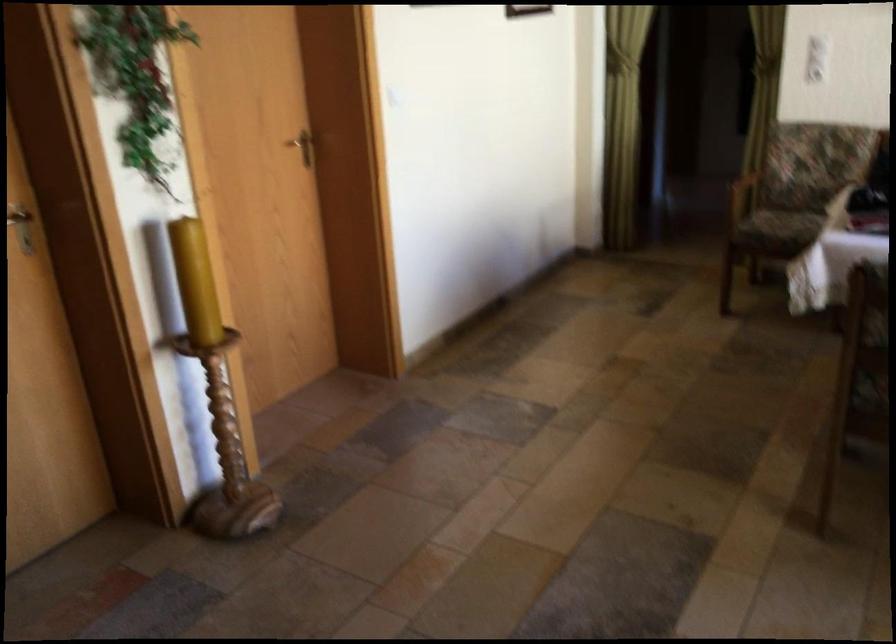
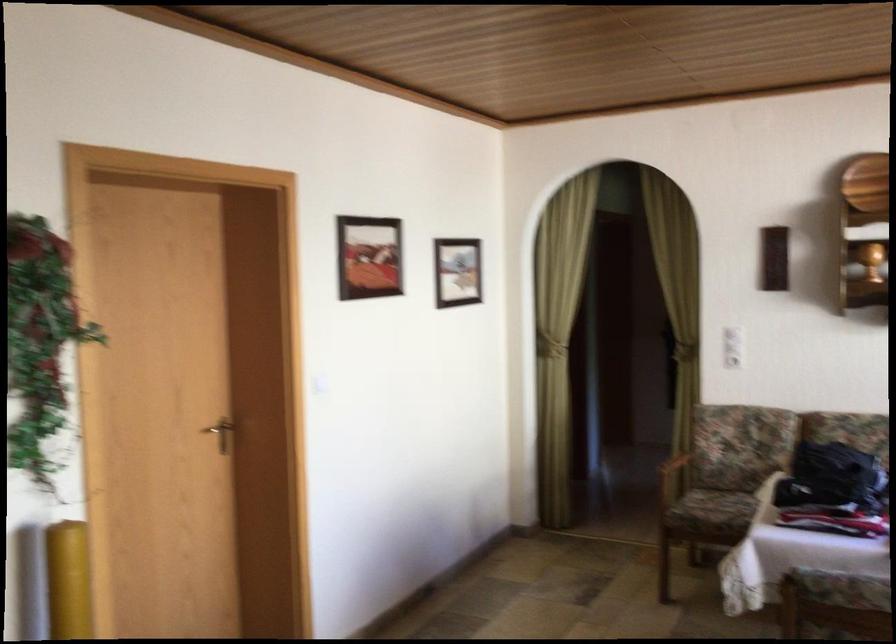
Find the pixel in the second image that matches the point at 195,267 in the first image.

(67, 580)